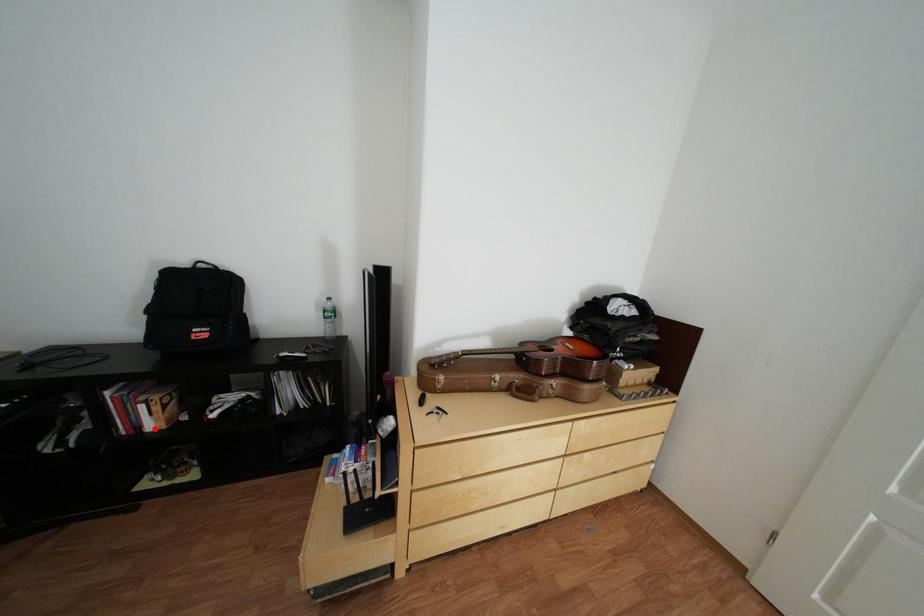
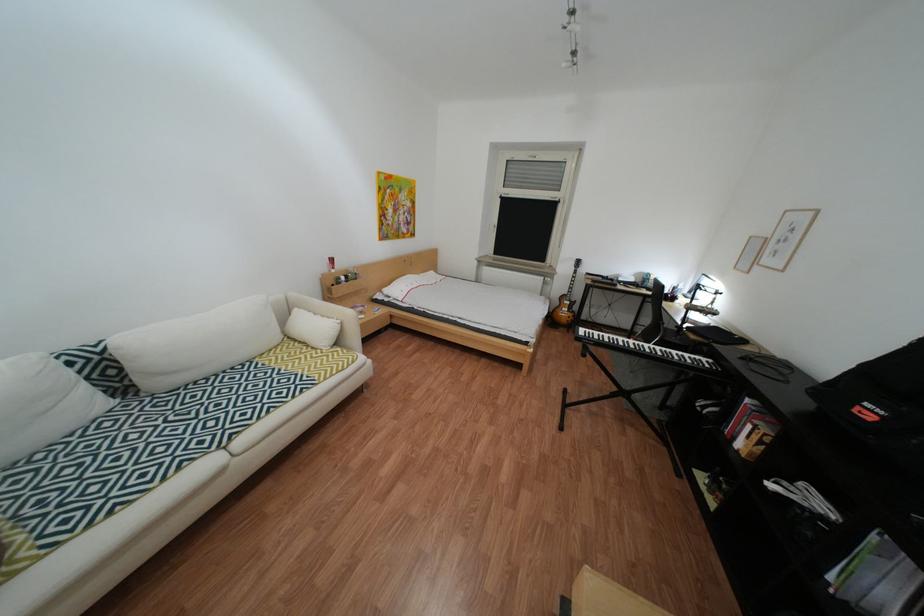
Question: I am providing you with two images of the same scene from different viewpoints. In image1, a red point is highlighted. Considering the same 3D point in image2, which of the following is correct?

Choices:
 (A) It is closer
 (B) It is farther

Answer: (B)